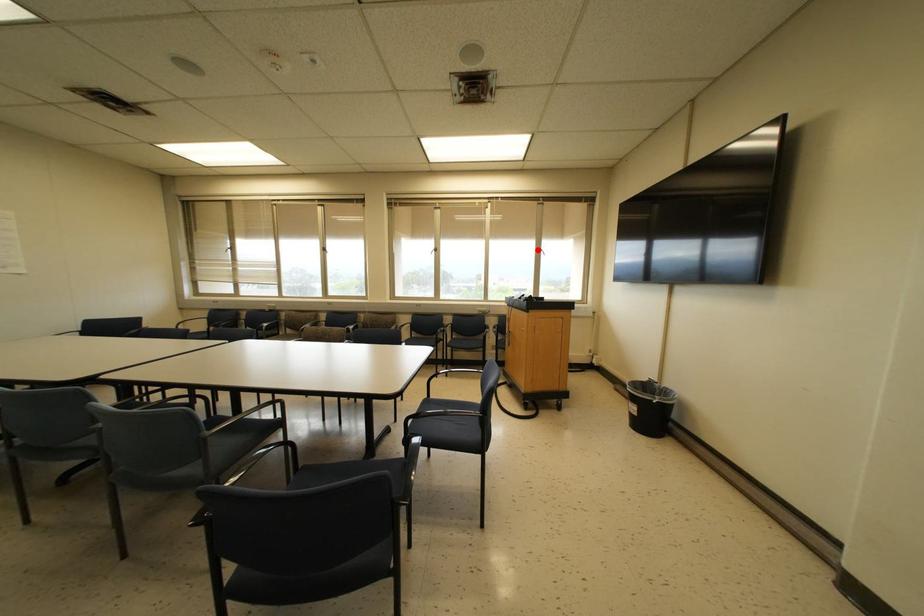
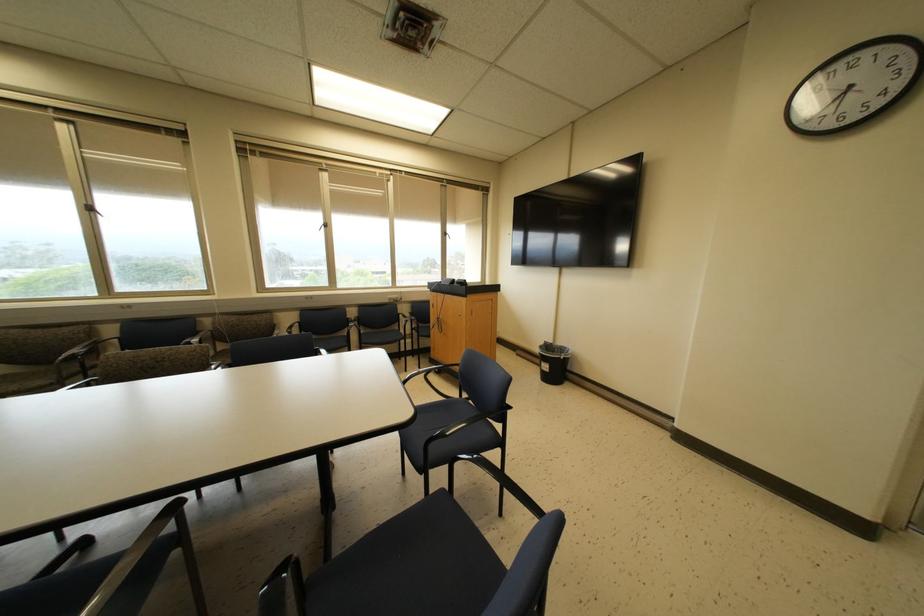
Locate, in the second image, the point that corresponds to the highlighted location in the first image.

(444, 233)